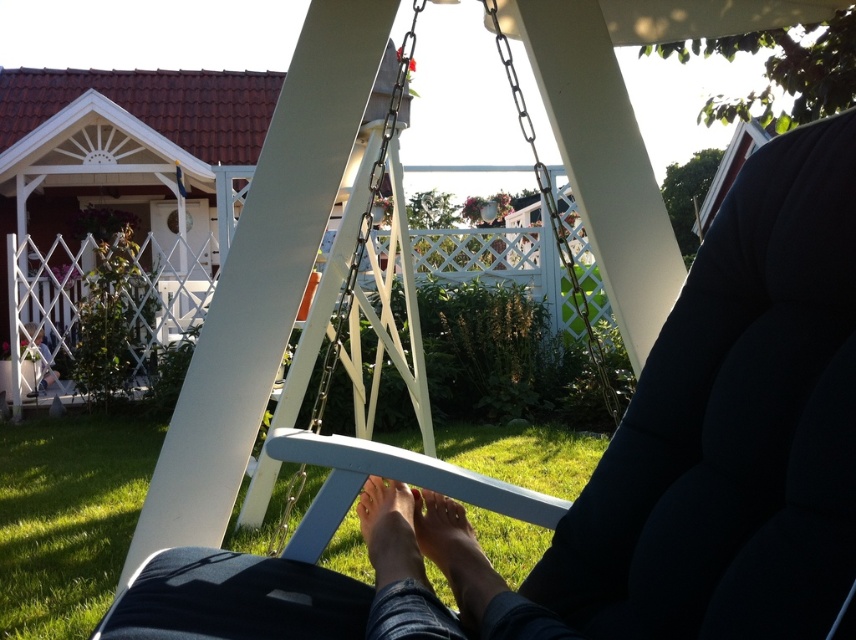
You are sitting on a swing and want to place a book on the matte black cushion at center. Based on the coordinates provided, is the cushion positioned directly in front of you or to one side?

The matte black cushion at center is located at point coordinates, so it is positioned directly in front of you.

You are sitting on a swing and want to adjust your position so that your foot is now on the left side of the cushion. Given that the matte black cushion at center is currently to the right of your smooth skin foot at center, can you move your foot to the left to achieve this?

Yes, since the matte black cushion at center is currently to the right of the smooth skin foot at center, moving your foot to the left would place it on the left side of the cushion.

Looking at this image, you are sitting on the swing and want to reach both points in the scene. Which point is closer to you, point (822, 134) or point (473, 536)?

Point (822, 134) is closer to the camera than point (473, 536), so you can reach it first.